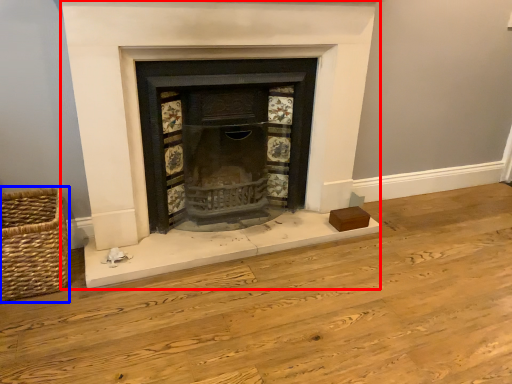
Question: Which point is further to the camera, fireplace (highlighted by a red box) or basket (highlighted by a blue box)?

Choices:
 (A) fireplace
 (B) basket

Answer: (B)